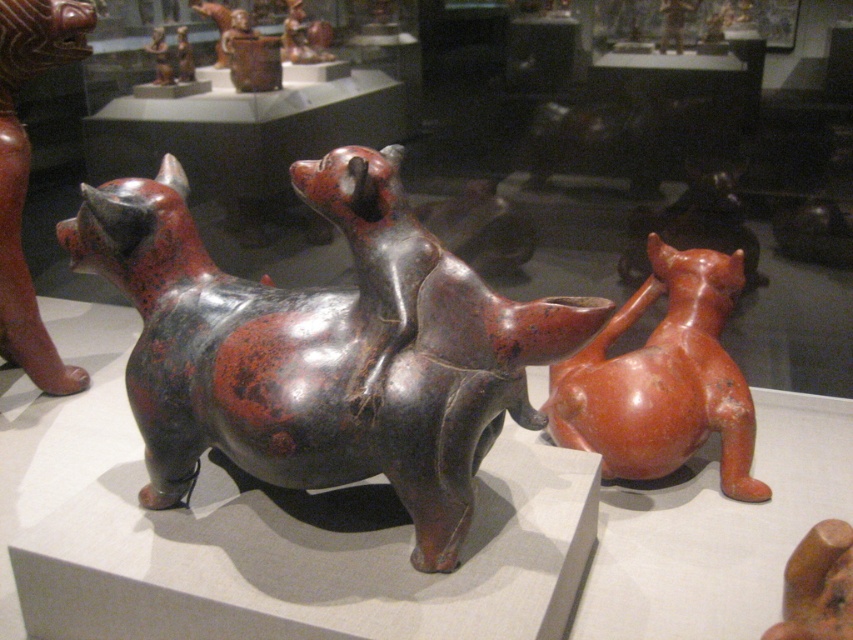
Question: Where is matte black dog at center located in relation to matte black cat at left in the image?

Choices:
 (A) left
 (B) right

Answer: (B)

Question: Where is matte black dog at center located in relation to matte orange vase at right in the image?

Choices:
 (A) right
 (B) left

Answer: (B)

Question: Which object appears farthest from the camera in this image?

Choices:
 (A) matte orange vase at right
 (B) matte black dog at center

Answer: (A)

Question: Which point appears farthest from the camera in this image?

Choices:
 (A) (22, 13)
 (B) (306, 321)
 (C) (637, 376)

Answer: (A)

Question: Can you confirm if matte black dog at center is positioned to the left of matte black cat at left?

Choices:
 (A) yes
 (B) no

Answer: (B)

Question: Which object is the closest to the matte black cat at left?

Choices:
 (A) matte orange vase at right
 (B) matte black dog at center

Answer: (B)